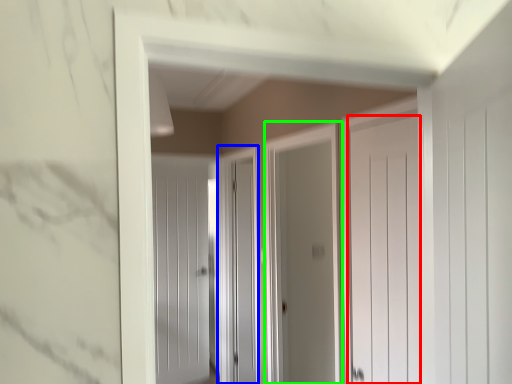
Question: Which object is the closest to the door (highlighted by a red box)? Choose among these: screen door (highlighted by a blue box) or screen door (highlighted by a green box).

Choices:
 (A) screen door
 (B) screen door

Answer: (B)